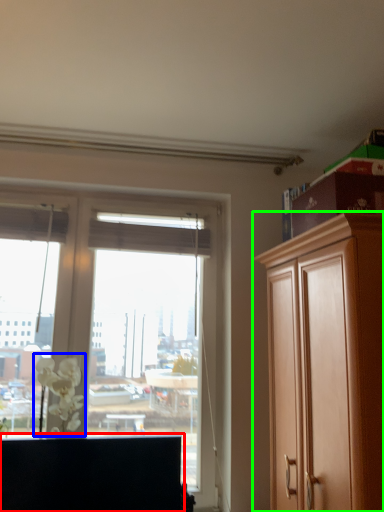
Question: Considering the real-world distances, which object is farthest from cabinetry (highlighted by a red box)? flower (highlighted by a blue box) or cabinetry (highlighted by a green box)?

Choices:
 (A) flower
 (B) cabinetry

Answer: (B)